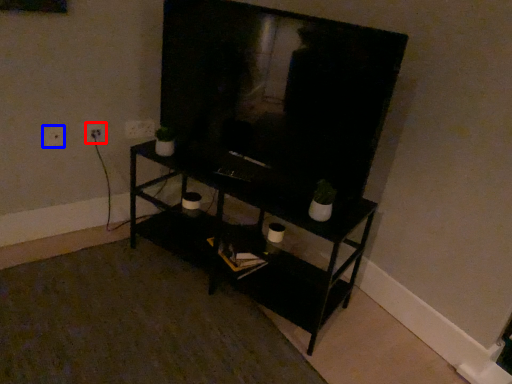
Question: Which of the following is the farthest to the observer, electric outlet (highlighted by a red box) or electric outlet (highlighted by a blue box)?

Choices:
 (A) electric outlet
 (B) electric outlet

Answer: (A)